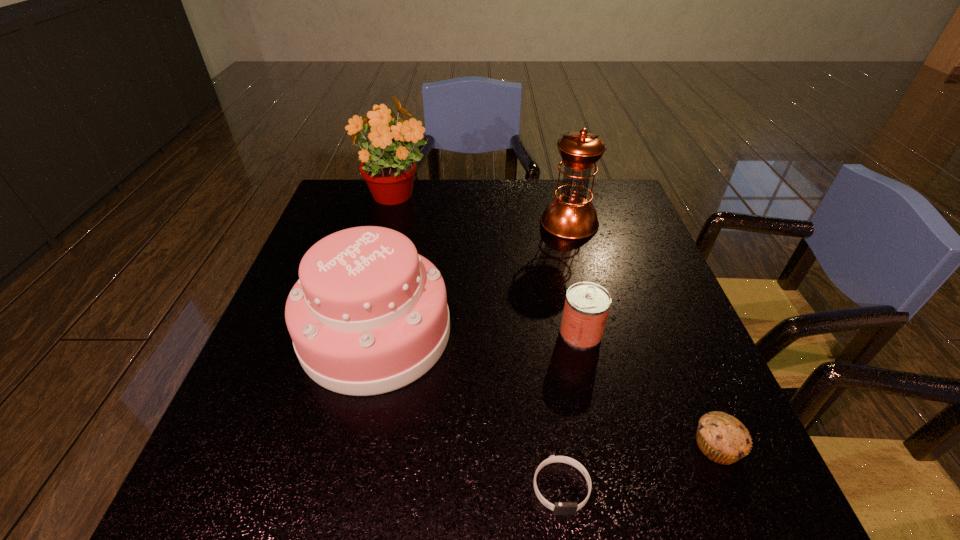
The image size is (960, 540). I want to click on blank region between the birthday cake and the can, so click(478, 333).

Locate an element on the screen. This screenshot has height=540, width=960. blank region between the birthday cake and the oil lamp is located at coordinates (472, 278).

At what (x,y) coordinates should I click in order to perform the action: click on unoccupied area between the fifth tallest object and the third tallest object. Please return your answer as a coordinate pair (x, y). Looking at the image, I should click on (546, 389).

At what (x,y) coordinates should I click in order to perform the action: click on vacant space that's between the flowerpot and the shortest object. Please return your answer as a coordinate pair (x, y). The height and width of the screenshot is (540, 960). Looking at the image, I should click on (478, 343).

The height and width of the screenshot is (540, 960). Identify the location of vacant space that's between the shortest object and the can. (571, 410).

The height and width of the screenshot is (540, 960). Find the location of `unoccupied position between the wristband and the flowerpot`. unoccupied position between the wristband and the flowerpot is located at coordinates (478, 343).

Where is `free space between the rightmost object and the third tallest object`? This screenshot has height=540, width=960. free space between the rightmost object and the third tallest object is located at coordinates (546, 389).

What are the coordinates of `free space between the rightmost object and the fourth shortest object` in the screenshot? It's located at (546, 389).

Where is `free spot between the birthday cake and the fourth tallest object`? free spot between the birthday cake and the fourth tallest object is located at coordinates (478, 333).

Find the location of a particular element. The height and width of the screenshot is (540, 960). vacant space that is in between the fifth tallest object and the wristband is located at coordinates (638, 467).